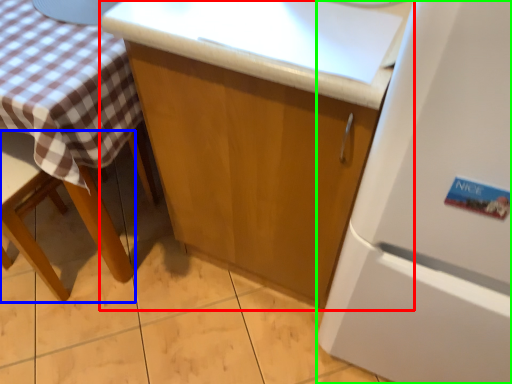
Question: Based on their relative distances, which object is nearer to cabinetry (highlighted by a red box)? Choose from chair (highlighted by a blue box) and refrigerator (highlighted by a green box).

Choices:
 (A) chair
 (B) refrigerator

Answer: (B)